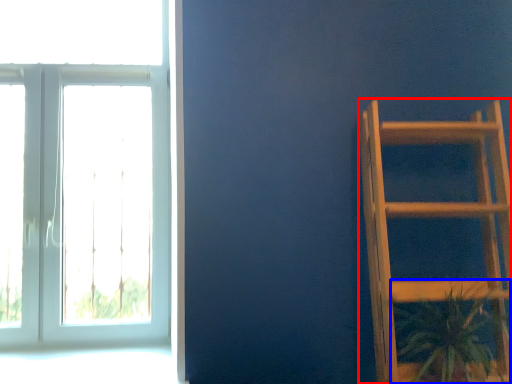
Question: Among these objects, which one is nearest to the camera, furniture (highlighted by a red box) or houseplant (highlighted by a blue box)?

Choices:
 (A) furniture
 (B) houseplant

Answer: (A)